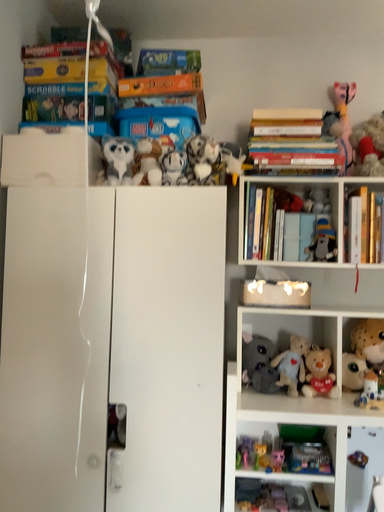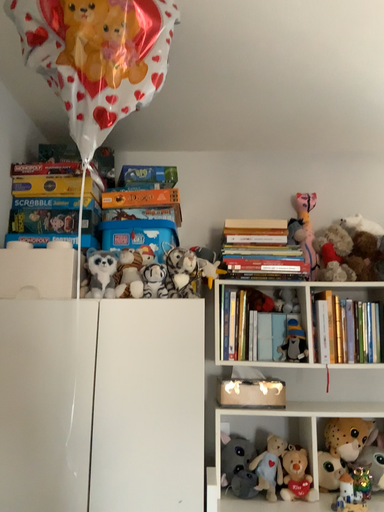
Question: Which way did the camera rotate in the video?

Choices:
 (A) rotated downward
 (B) rotated upward

Answer: (B)